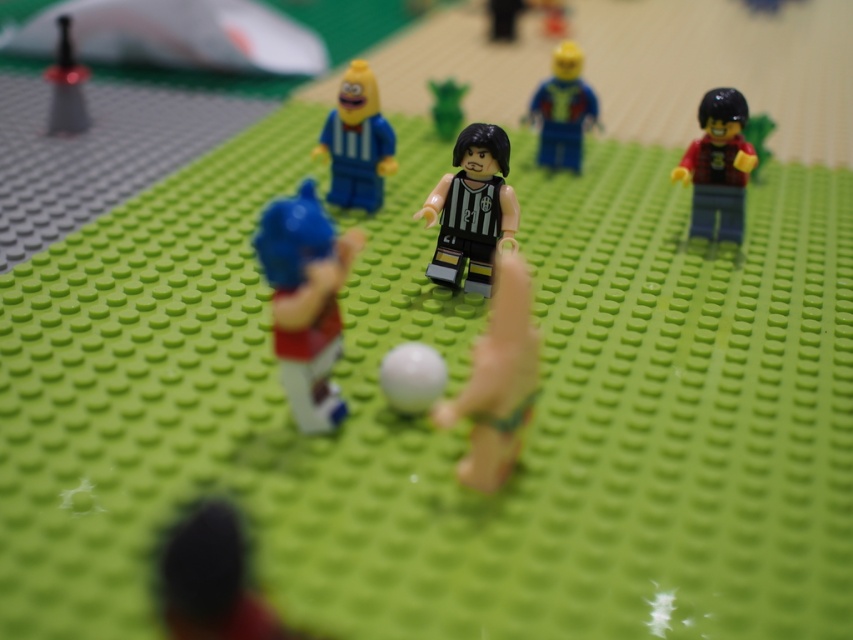
How much distance is there between black matte figure at center and shiny blue figure at upper center?

black matte figure at center is 50.61 centimeters from shiny blue figure at upper center.

Does black matte figure at center appear on the right side of shiny blue figure at upper center?

No, black matte figure at center is not to the right of shiny blue figure at upper center.

In the scene shown: Who is more distant from viewer, (467, 262) or (569, 120)?

The point (569, 120) is behind.

Where is `black matte figure at center`? The width and height of the screenshot is (853, 640). black matte figure at center is located at coordinates (473, 209).

Between smooth black figure at lower left and black matte figure at center, which one has more height?

With more height is black matte figure at center.

Does smooth black figure at lower left have a greater height compared to black matte figure at center?

No, smooth black figure at lower left is not taller than black matte figure at center.

Is point (209, 513) positioned before point (442, 259)?

Yes.

Locate an element on the screen. smooth black figure at lower left is located at coordinates (212, 580).

Which is more to the left, black glossy referee at center or shiny blue figure at upper center?

black glossy referee at center

Which is in front, point (529, 394) or point (579, 72)?

Point (529, 394)

Where is `black glossy referee at center`? The height and width of the screenshot is (640, 853). black glossy referee at center is located at coordinates (497, 380).